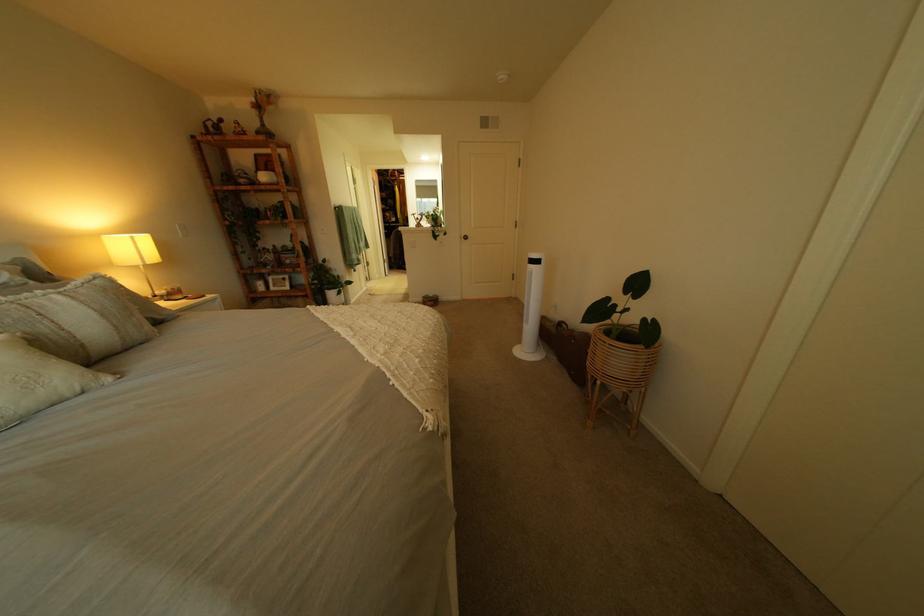
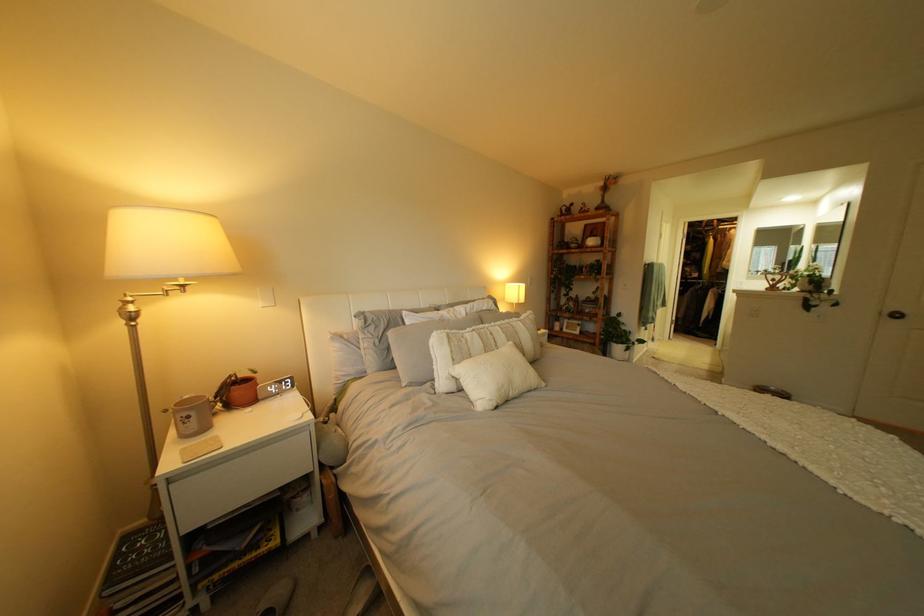
Locate, in the second image, the point that corresponds to point 478,237 in the first image.

(903, 313)